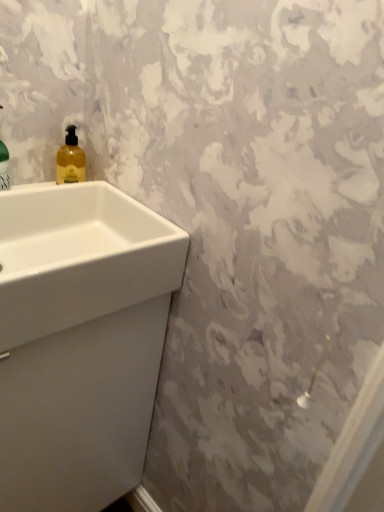
Measure the distance between point (x=158, y=267) and camera.

Point (x=158, y=267) is 77.90 centimeters away from camera.

Where is `white glossy sink at lower left, the first sink when ordered from bottom to top`? The image size is (384, 512). white glossy sink at lower left, the first sink when ordered from bottom to top is located at coordinates [x=80, y=340].

Identify the location of yellow translucent liquid at upper left. This screenshot has width=384, height=512. (70, 159).

From a real-world perspective, is white glossy sink at lower left, the second sink viewed from the top, below yellow translucent liquid at upper left?

Correct, in the physical world, white glossy sink at lower left, the second sink viewed from the top, is lower than yellow translucent liquid at upper left.

Is white glossy sink at lower left, the second sink viewed from the top, facing towards yellow translucent liquid at upper left?

No.

Does white glossy sink at lower left, the second sink viewed from the top, have a lesser height compared to yellow translucent liquid at upper left?

No.

Which is behind, point (70, 482) or point (63, 146)?

Positioned behind is point (63, 146).

Is white glossy sink at left, acting as the second sink starting from the bottom, oriented towards white glossy sink at lower left, the second sink viewed from the top?

No, white glossy sink at left, acting as the second sink starting from the bottom, does not turn towards white glossy sink at lower left, the second sink viewed from the top.

Is white glossy sink at left, the first sink in the top-to-bottom sequence, wider or thinner than white glossy sink at lower left, the first sink when ordered from bottom to top?

Clearly, white glossy sink at left, the first sink in the top-to-bottom sequence, has less width compared to white glossy sink at lower left, the first sink when ordered from bottom to top.

From the image's perspective, which one is positioned lower, white glossy sink at left, the first sink in the top-to-bottom sequence, or white glossy sink at lower left, the second sink viewed from the top?

white glossy sink at lower left, the second sink viewed from the top.

In the scene shown: Which is further, (93, 227) or (102, 255)?

The point (93, 227) is more distant.

Would you say white glossy sink at lower left, the first sink when ordered from bottom to top, is to the left or to the right of white glossy sink at left, the first sink in the top-to-bottom sequence, in the picture?

Clearly, white glossy sink at lower left, the first sink when ordered from bottom to top, is on the left of white glossy sink at left, the first sink in the top-to-bottom sequence, in the image.

From the image's perspective, is white glossy sink at lower left, the second sink viewed from the top, located above or below white glossy sink at left, acting as the second sink starting from the bottom?

Clearly, from the image's perspective, white glossy sink at lower left, the second sink viewed from the top, is below white glossy sink at left, acting as the second sink starting from the bottom.

Is white glossy sink at lower left, the first sink when ordered from bottom to top, positioned with its back to white glossy sink at left, acting as the second sink starting from the bottom?

That's not correct — white glossy sink at lower left, the first sink when ordered from bottom to top, is not looking away from white glossy sink at left, acting as the second sink starting from the bottom.

Based on the photo, is yellow translucent liquid at upper left further to camera compared to white glossy sink at left, acting as the second sink starting from the bottom?

Yes.

Is yellow translucent liquid at upper left bigger than white glossy sink at left, acting as the second sink starting from the bottom?

Incorrect, yellow translucent liquid at upper left is not larger than white glossy sink at left, acting as the second sink starting from the bottom.

Is white glossy sink at left, the first sink in the top-to-bottom sequence, surrounded by yellow translucent liquid at upper left?

No, white glossy sink at left, the first sink in the top-to-bottom sequence, is not a part of yellow translucent liquid at upper left.

Between yellow translucent liquid at upper left and white glossy sink at left, the first sink in the top-to-bottom sequence, which one appears on the left side from the viewer's perspective?

white glossy sink at left, the first sink in the top-to-bottom sequence, is more to the left.

Does white glossy sink at left, acting as the second sink starting from the bottom, have a smaller size compared to yellow translucent liquid at upper left?

Actually, white glossy sink at left, acting as the second sink starting from the bottom, might be larger than yellow translucent liquid at upper left.

Can you confirm if white glossy sink at left, the first sink in the top-to-bottom sequence, is wider than yellow translucent liquid at upper left?

Yes.

Where is `soap dispenser above the white glossy sink at left, acting as the second sink starting from the bottom (from the image's perspective)`? The height and width of the screenshot is (512, 384). soap dispenser above the white glossy sink at left, acting as the second sink starting from the bottom (from the image's perspective) is located at coordinates (70, 159).

Which of these two, white glossy sink at left, acting as the second sink starting from the bottom, or yellow translucent liquid at upper left, stands shorter?

yellow translucent liquid at upper left is shorter.

Is yellow translucent liquid at upper left far from white glossy sink at lower left, the first sink when ordered from bottom to top?

That's not correct — yellow translucent liquid at upper left is a little close to white glossy sink at lower left, the first sink when ordered from bottom to top.

Does point (75, 144) lie in front of point (135, 237)?

No, it is behind (135, 237).

Could you tell me if yellow translucent liquid at upper left is facing white glossy sink at lower left, the first sink when ordered from bottom to top?

No, yellow translucent liquid at upper left is not aimed at white glossy sink at lower left, the first sink when ordered from bottom to top.

From a real-world perspective, is yellow translucent liquid at upper left physically below white glossy sink at lower left, the second sink viewed from the top?

Actually, yellow translucent liquid at upper left is physically above white glossy sink at lower left, the second sink viewed from the top, in the real world.

From the image's perspective, which sink is the 2nd one below the yellow translucent liquid at upper left? Please provide its 2D coordinates.

[(80, 340)]

Find the location of a particular element. sink above the white glossy sink at lower left, the first sink when ordered from bottom to top (from the image's perspective) is located at coordinates (79, 257).

In the scene shown: Looking at the image, which one is located further to white glossy sink at lower left, the second sink viewed from the top, white glossy sink at left, the first sink in the top-to-bottom sequence, or yellow translucent liquid at upper left?

Based on the image, yellow translucent liquid at upper left appears to be further to white glossy sink at lower left, the second sink viewed from the top.

From the image, which object appears to be nearer to white glossy sink at left, the first sink in the top-to-bottom sequence, white glossy sink at lower left, the first sink when ordered from bottom to top, or yellow translucent liquid at upper left?

white glossy sink at lower left, the first sink when ordered from bottom to top, is positioned closer to the anchor white glossy sink at left, the first sink in the top-to-bottom sequence.

Consider the image. Estimate the real-world distances between objects in this image. Which object is further from yellow translucent liquid at upper left, white glossy sink at lower left, the second sink viewed from the top, or white glossy sink at left, acting as the second sink starting from the bottom?

white glossy sink at lower left, the second sink viewed from the top.

Looking at the image, which one is located further to white glossy sink at lower left, the second sink viewed from the top, yellow translucent liquid at upper left or white glossy sink at left, the first sink in the top-to-bottom sequence?

yellow translucent liquid at upper left is positioned further to the anchor white glossy sink at lower left, the second sink viewed from the top.

Which object lies nearer to the anchor point white glossy sink at left, acting as the second sink starting from the bottom, yellow translucent liquid at upper left or white glossy sink at lower left, the first sink when ordered from bottom to top?

white glossy sink at lower left, the first sink when ordered from bottom to top, lies closer to white glossy sink at left, acting as the second sink starting from the bottom, than the other object.

Estimate the real-world distances between objects in this image. Which object is closer to yellow translucent liquid at upper left, white glossy sink at left, acting as the second sink starting from the bottom, or white glossy sink at lower left, the second sink viewed from the top?

white glossy sink at left, acting as the second sink starting from the bottom, is closer to yellow translucent liquid at upper left.

Locate an element on the screen. sink between yellow translucent liquid at upper left and white glossy sink at lower left, the first sink when ordered from bottom to top, from top to bottom is located at coordinates (79, 257).